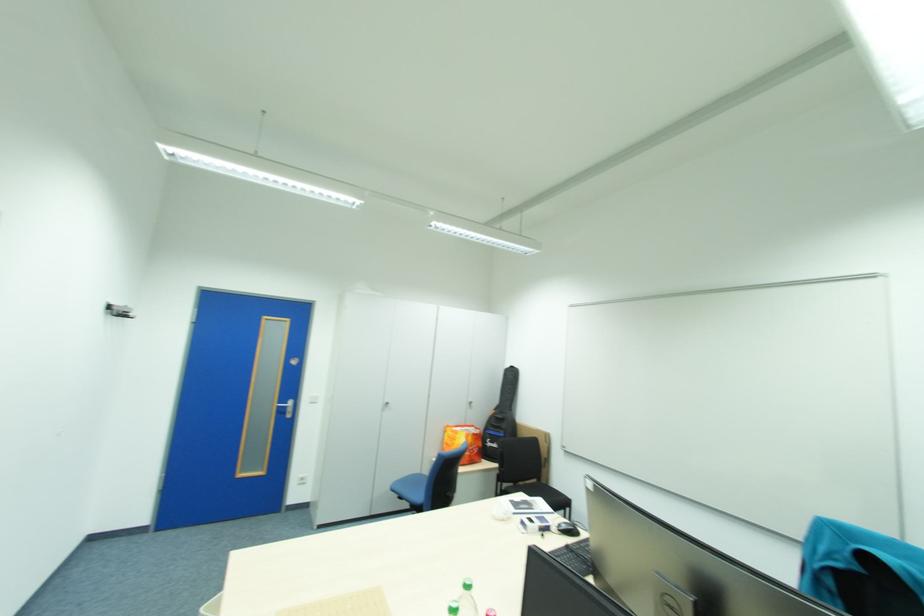
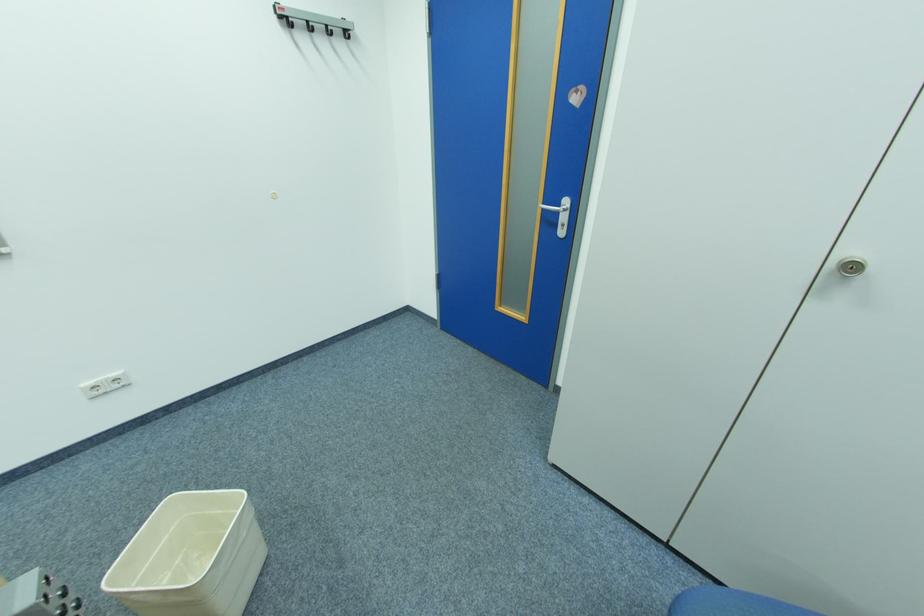
Find the pixel in the second image that matches (286,407) in the first image.

(552, 209)